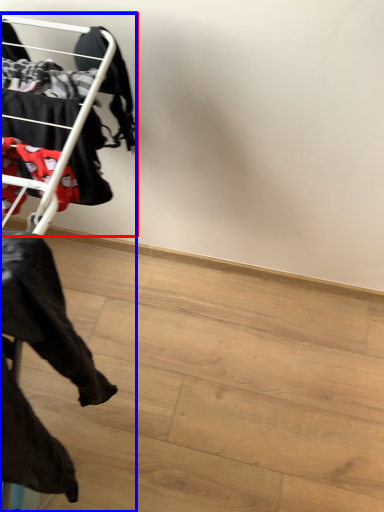
Question: Which object appears closest to the camera in this image, bunk bed (highlighted by a red box) or furniture (highlighted by a blue box)?

Choices:
 (A) bunk bed
 (B) furniture

Answer: (B)